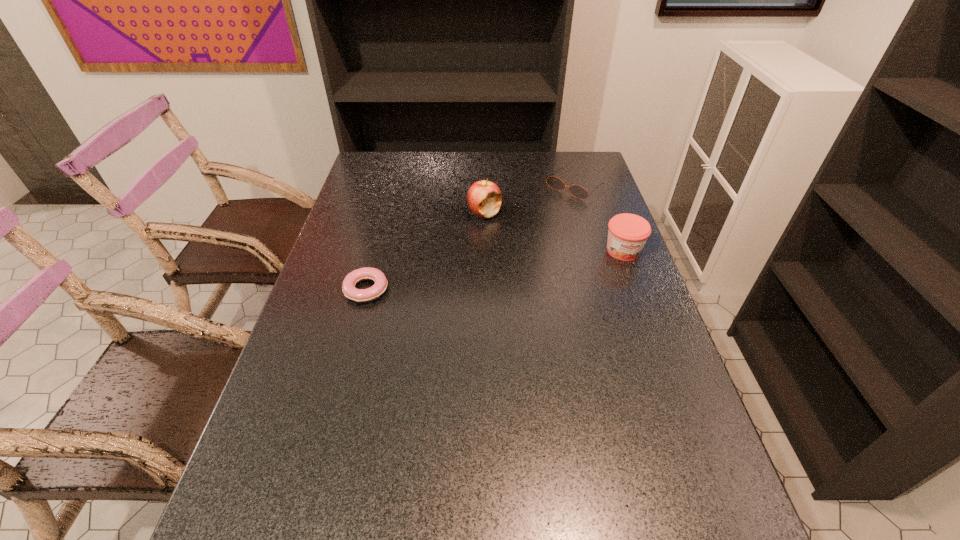
Image resolution: width=960 pixels, height=540 pixels. Find the location of `free space on the desktop that is between the doughnut and the third farthest object and is positioned on the face of the third tallest object`. free space on the desktop that is between the doughnut and the third farthest object and is positioned on the face of the third tallest object is located at coordinates click(468, 274).

In order to click on free space on the desktop that is between the leftmost object and the third shortest object and is positioned on the bitten side of the apple in this screenshot , I will do `click(466, 274)`.